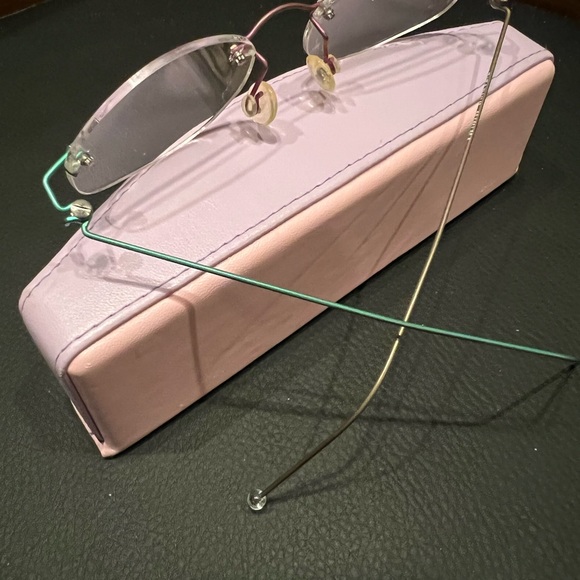
You are a GUI agent. You are given a task and a screenshot of the screen. Output one action in this format:
    pyautogui.click(x=<x>, y=<y>)
    Task: Click on the glass case
    The image size is (580, 580).
    Given the screenshot: What is the action you would take?
    pyautogui.click(x=179, y=338)